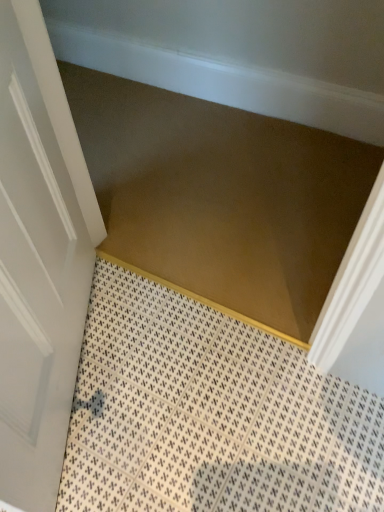
Measure the distance between point [123,384] and camera.

Point [123,384] is 1.21 meters from camera.

The height and width of the screenshot is (512, 384). What do you see at coordinates (209, 413) in the screenshot?
I see `white textured tile at center` at bounding box center [209, 413].

Measure the distance between white textured tile at center and camera.

white textured tile at center is 3.31 feet away from camera.

The width and height of the screenshot is (384, 512). In order to click on white textured tile at center in this screenshot , I will do `click(209, 413)`.

You are a GUI agent. You are given a task and a screenshot of the screen. Output one action in this format:
    pyautogui.click(x=<x>, y=<y>)
    Task: Click on the white textured tile at center
    This screenshot has height=512, width=384.
    Given the screenshot: What is the action you would take?
    pyautogui.click(x=209, y=413)